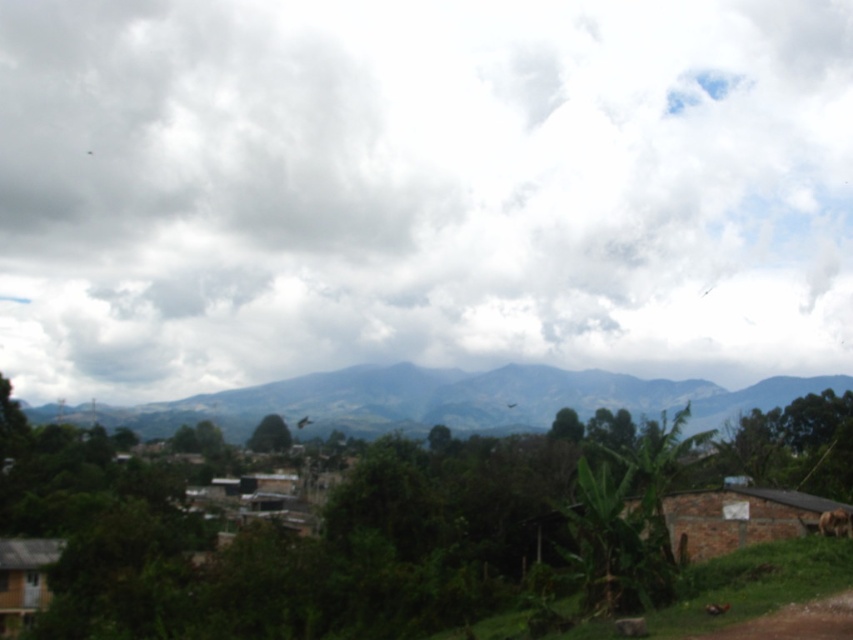
Question: Does white fluffy cloud at upper center have a smaller size compared to brown furry dog at lower right?

Choices:
 (A) no
 (B) yes

Answer: (A)

Question: Which of the following is the closest to the observer?

Choices:
 (A) brown brick hut at lower right
 (B) brown furry dog at lower right

Answer: (A)

Question: In this image, where is wooden hut at lower left located relative to brown furry dog at lower right?

Choices:
 (A) above
 (B) below

Answer: (B)

Question: Is white fluffy cloud at upper center smaller than brown dirt track at lower right?

Choices:
 (A) no
 (B) yes

Answer: (A)

Question: Which of the following is the farthest from the observer?

Choices:
 (A) white fluffy cloud at upper center
 (B) green textured mountain at center
 (C) brown dirt track at lower right
 (D) brown furry dog at lower right

Answer: (A)

Question: Which object is closer to the camera taking this photo?

Choices:
 (A) brown furry dog at lower right
 (B) brown dirt track at lower right
 (C) wooden hut at lower left
 (D) brown brick hut at lower right

Answer: (B)